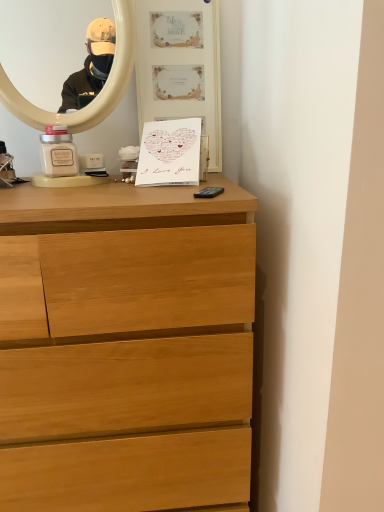
Measure the distance between light wood chest of drawers at lower left and camera.

light wood chest of drawers at lower left is 29.21 inches away from camera.

Describe the element at coordinates (126, 343) in the screenshot. I see `light wood chest of drawers at lower left` at that location.

Locate an element on the screen. This screenshot has height=512, width=384. light wood chest of drawers at lower left is located at coordinates (126, 343).

This screenshot has height=512, width=384. Identify the location of light wood chest of drawers at lower left. (126, 343).